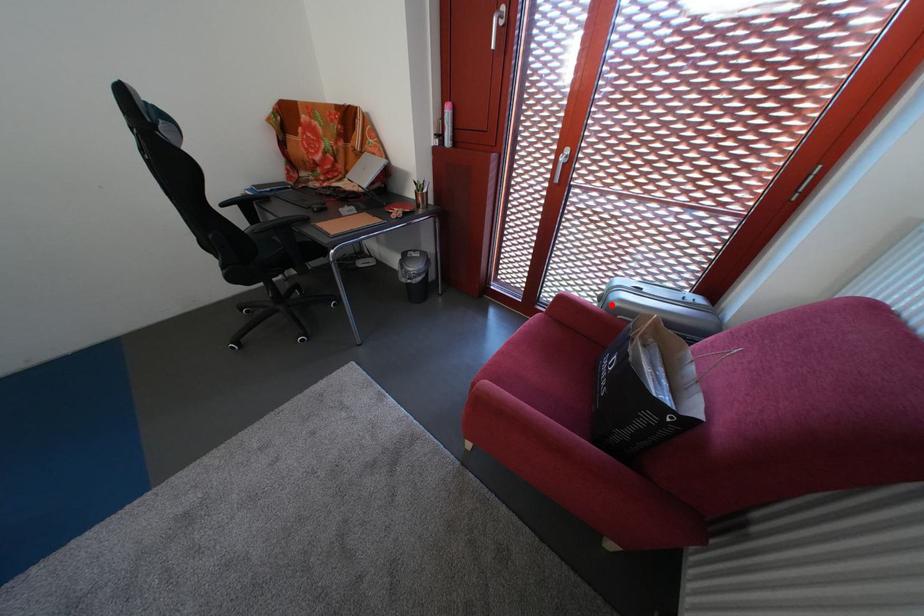
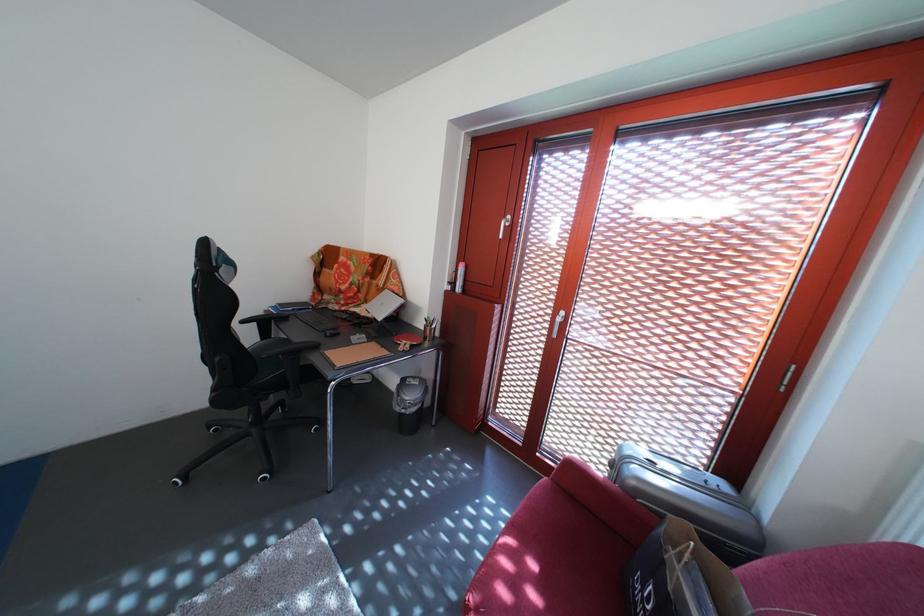
In the second image, find the point that corresponds to the highlighted location in the first image.

(623, 471)